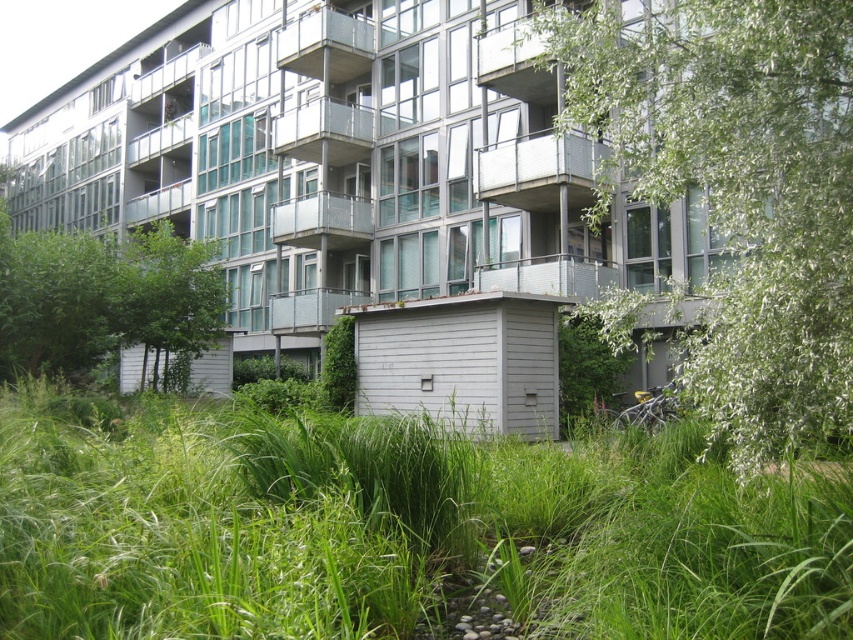
Question: Can you confirm if green grass at center is positioned to the right of green leafy tree at left?

Choices:
 (A) yes
 (B) no

Answer: (A)

Question: Which object is closer to the camera taking this photo?

Choices:
 (A) green leafy tree at right
 (B) green grass at center

Answer: (B)

Question: Does green leafy tree at right come behind green leafy tree at center?

Choices:
 (A) yes
 (B) no

Answer: (B)

Question: Among these points, which one is farthest from the camera?

Choices:
 (A) coord(183,333)
 (B) coord(614,472)
 (C) coord(786,138)
 (D) coord(96,268)

Answer: (A)

Question: Which object is the closest to the green leafy tree at left?

Choices:
 (A) green grass at center
 (B) green leafy tree at right

Answer: (A)

Question: Observing the image, what is the correct spatial positioning of green leafy tree at right in reference to green leafy tree at left?

Choices:
 (A) below
 (B) above

Answer: (B)